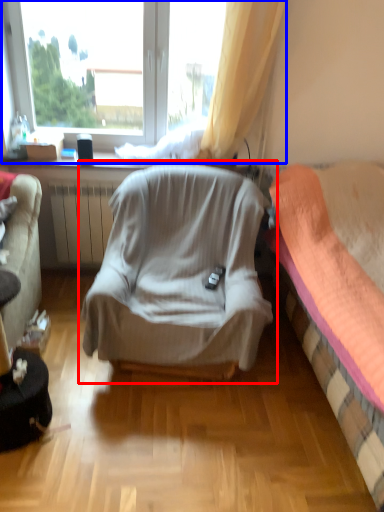
Question: Which of the following is the closest to the observer, chair (highlighted by a red box) or window (highlighted by a blue box)?

Choices:
 (A) chair
 (B) window

Answer: (A)